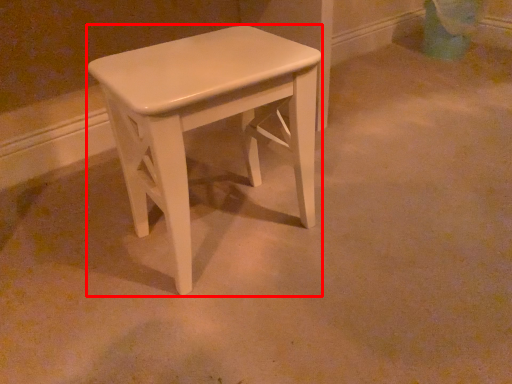
Question: From the image's perspective, considering the relative positions of stool (annotated by the red box) and swivel chair in the image provided, where is stool (annotated by the red box) located with respect to the staircase?

Choices:
 (A) below
 (B) above

Answer: (A)